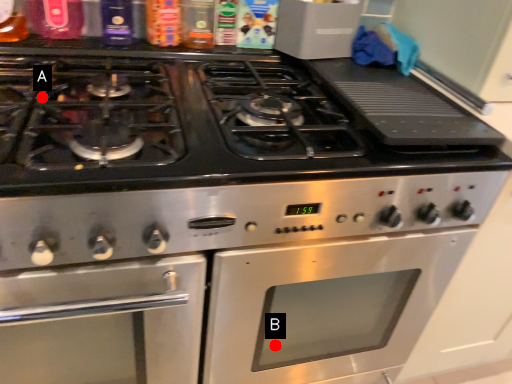
Question: Two points are circled on the image, labeled by A and B beside each circle. Which point is farther from the camera taking this photo?

Choices:
 (A) A is further
 (B) B is further

Answer: (B)